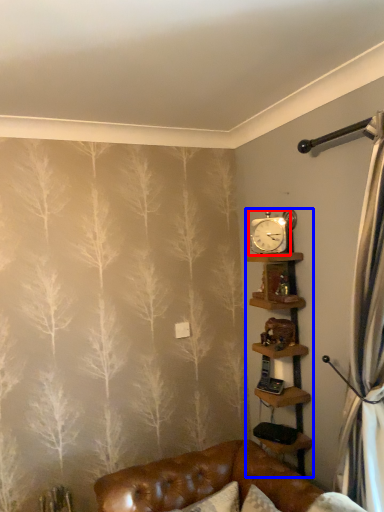
Question: Which of the following is the closest to the observer, clock (highlighted by a red box) or shelf (highlighted by a blue box)?

Choices:
 (A) clock
 (B) shelf

Answer: (B)